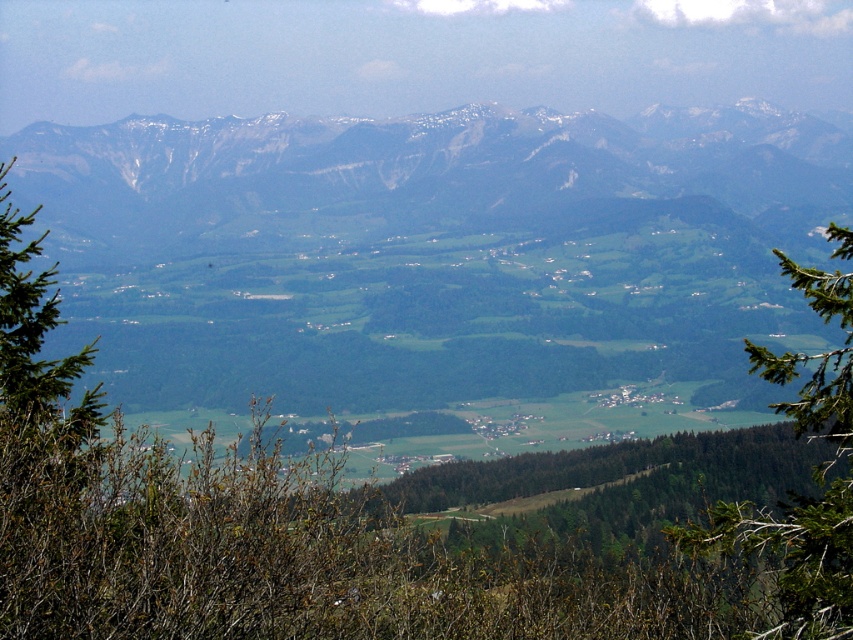
You are standing at the point closest to the camera in the image. Which of the two points, point (202, 129) or point (782, 616), is closer to your current position?

Point (202, 129) is further to the camera than point (782, 616). Therefore, the point closer to your current position is point (782, 616).